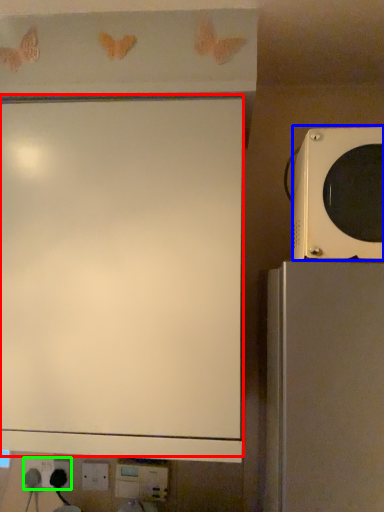
Question: Considering the real-world distances, which object is farthest from projection screen (highlighted by a red box)? microwave oven (highlighted by a blue box) or electric outlet (highlighted by a green box)?

Choices:
 (A) microwave oven
 (B) electric outlet

Answer: (B)